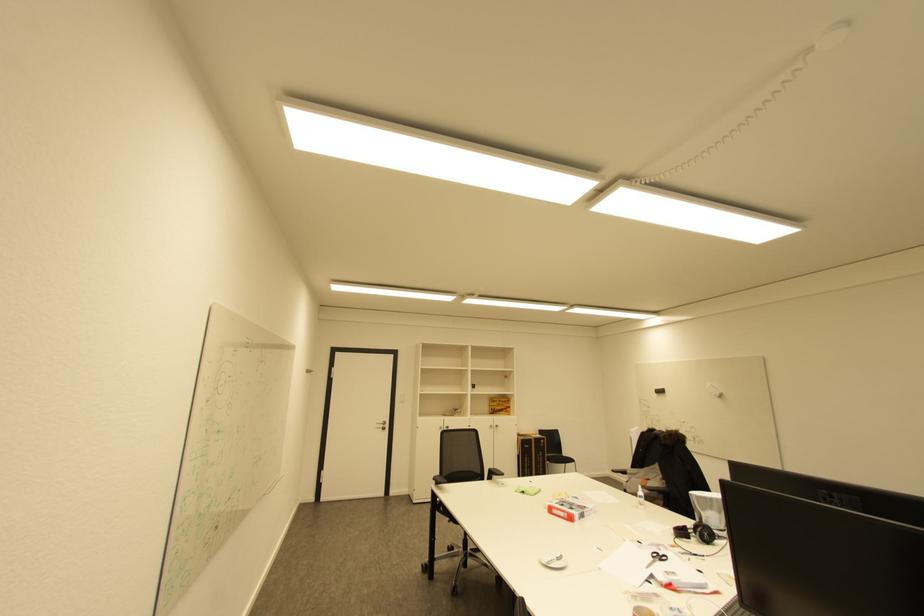
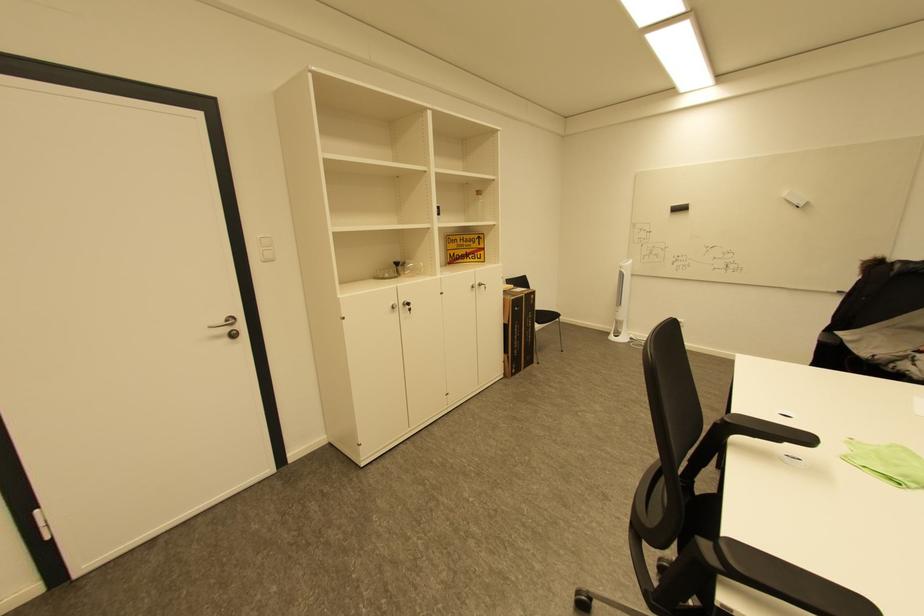
Where in the second image is the point corresponding to point (666, 392) from the first image?

(686, 209)